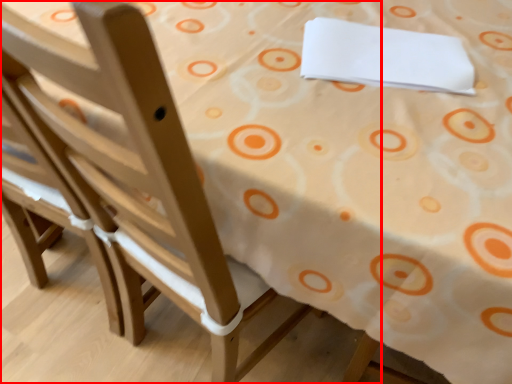
Question: In this image, where is chair (annotated by the red box) located relative to linen?

Choices:
 (A) left
 (B) right

Answer: (A)